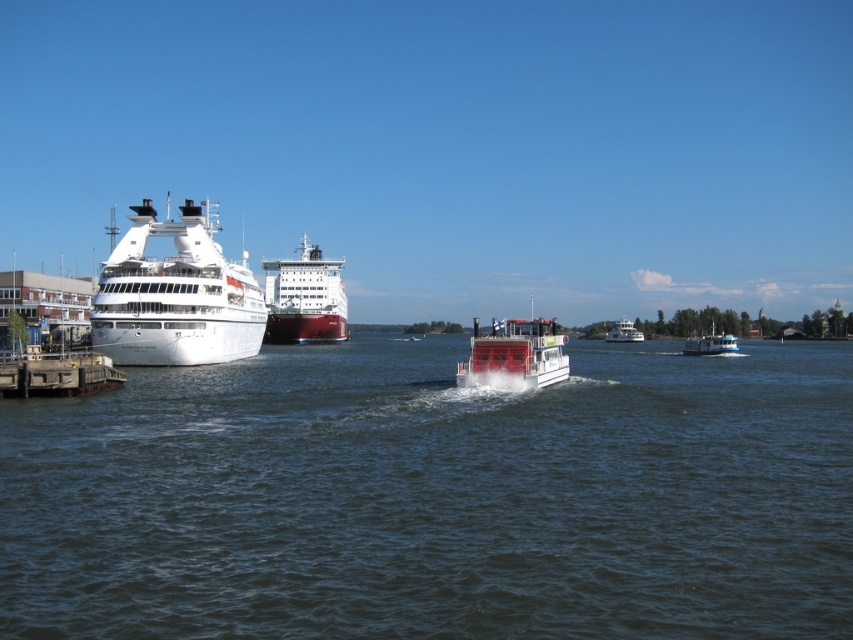
In the scene shown: Measure the distance from dark blue water at center to white glossy boat at upper center.

dark blue water at center is 110.18 meters away from white glossy boat at upper center.

Does dark blue water at center appear under white glossy boat at upper center?

Yes.

Does point (708, 362) come behind point (635, 340)?

No.

This screenshot has height=640, width=853. Find the location of `dark blue water at center`. dark blue water at center is located at coordinates [436, 497].

Is white glossy ferry at center wider than white glossy boat at upper center?

No, white glossy ferry at center is not wider than white glossy boat at upper center.

Which is above, white glossy ferry at center or white glossy boat at upper center?

white glossy ferry at center

I want to click on white glossy ferry at center, so click(x=515, y=353).

Who is positioned more to the left, red matte cargo ship at center or white glossy ferry at center?

red matte cargo ship at center

This screenshot has height=640, width=853. What do you see at coordinates (305, 298) in the screenshot? I see `red matte cargo ship at center` at bounding box center [305, 298].

Is point (312, 317) farther from camera compared to point (480, 342)?

Yes, it is behind point (480, 342).

Find the location of a particular element. red matte cargo ship at center is located at coordinates (305, 298).